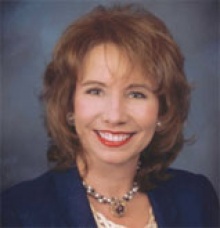
The height and width of the screenshot is (228, 220). In order to click on pendant in this screenshot , I will do `click(121, 207)`.